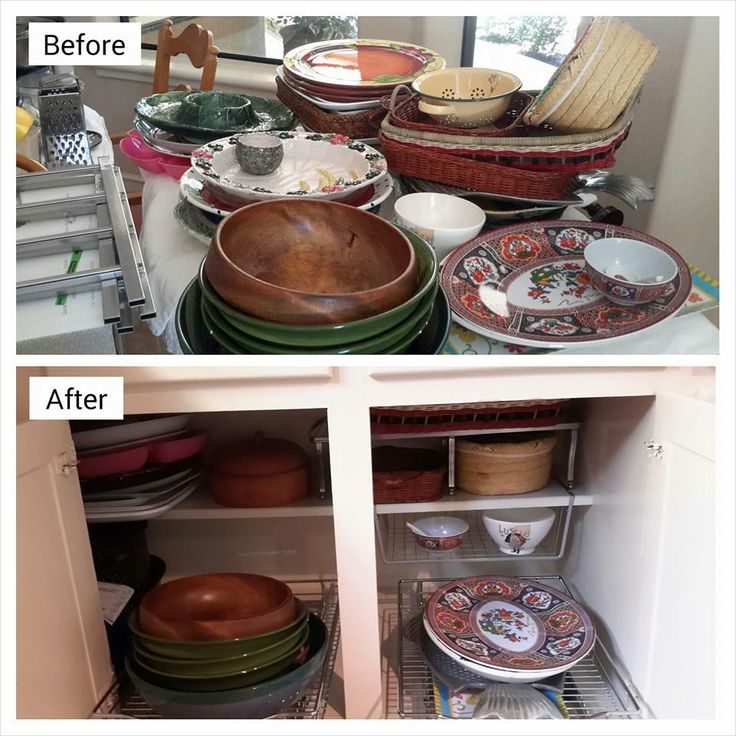
The width and height of the screenshot is (736, 736). I want to click on cheese grater, so click(x=63, y=121).